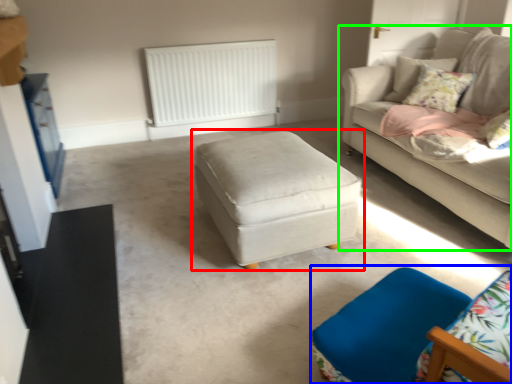
Question: Based on their relative distances, which object is nearer to table (highlighted by a red box)? Choose from swivel chair (highlighted by a blue box) and studio couch (highlighted by a green box).

Choices:
 (A) swivel chair
 (B) studio couch

Answer: (A)